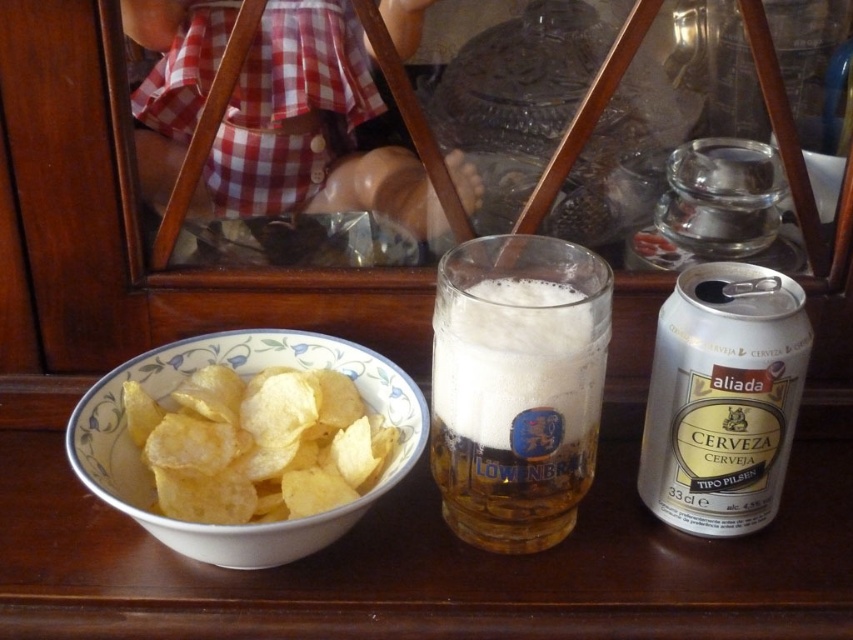
Question: Which point is farther to the camera?

Choices:
 (A) foamy glass beer at center
 (B) golden crispy chips at left
 (C) silver metallic can at right

Answer: (B)

Question: Considering the real-world distances, which object is closest to the golden crispy chips at left?

Choices:
 (A) foamy glass beer at center
 (B) silver metallic can at right

Answer: (A)

Question: Which of these objects is positioned closest to the golden crispy chips at left?

Choices:
 (A) silver metallic can at right
 (B) foamy glass beer at center

Answer: (B)

Question: Is foamy glass beer at center smaller than golden crispy chips at left?

Choices:
 (A) no
 (B) yes

Answer: (A)

Question: Does silver metallic can at right have a smaller size compared to golden crispy chips at left?

Choices:
 (A) no
 (B) yes

Answer: (B)

Question: Does foamy glass beer at center have a larger size compared to golden crispy chips at left?

Choices:
 (A) yes
 (B) no

Answer: (A)